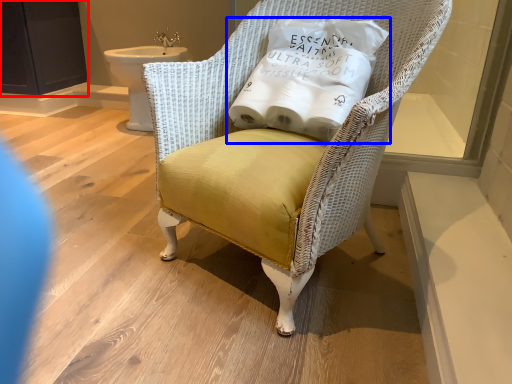
Question: Which of the following is the closest to the observer, screen door (highlighted by a red box) or pillow (highlighted by a blue box)?

Choices:
 (A) screen door
 (B) pillow

Answer: (B)